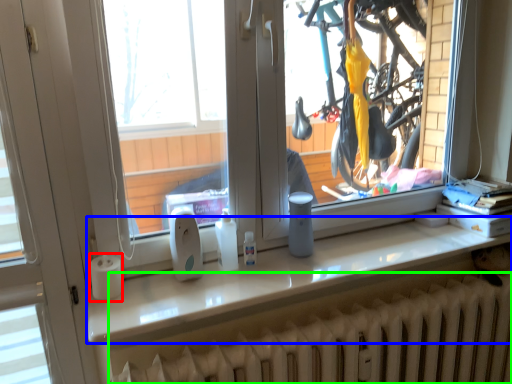
Question: Which object is positioned farthest from paper towel (highlighted by a red box)? Select from counter top (highlighted by a blue box) and radiator (highlighted by a green box).

Choices:
 (A) counter top
 (B) radiator

Answer: (B)